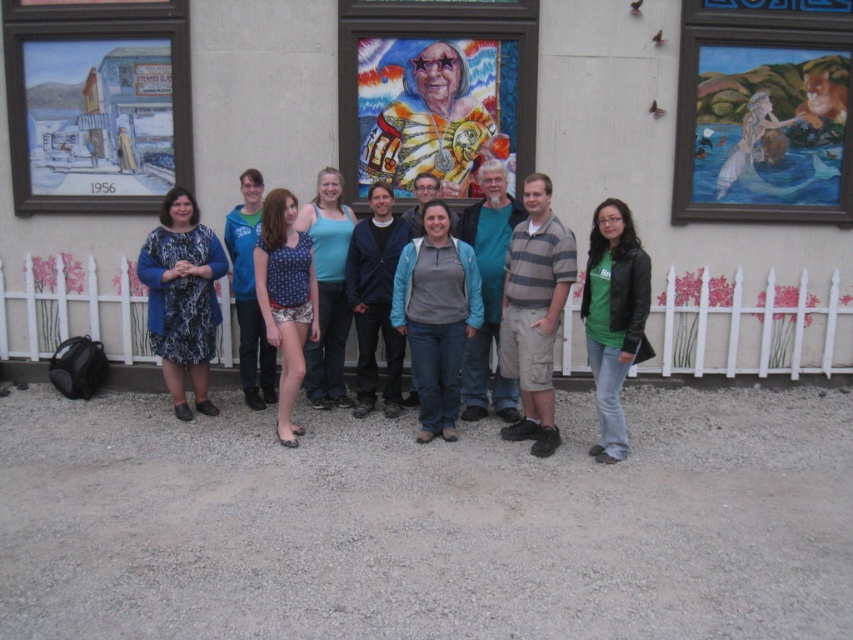
Question: Can you confirm if matte gray sweater at center is positioned to the right of blue printed shorts at center?

Choices:
 (A) no
 (B) yes

Answer: (B)

Question: Does green matte jacket at lower right have a smaller size compared to blue fabric tank top at center?

Choices:
 (A) no
 (B) yes

Answer: (B)

Question: Which is farther from the green matte jacket at lower right?

Choices:
 (A) matte gray sweater at center
 (B) blue fabric tank top at center

Answer: (B)

Question: Does matte gray sweater at center have a larger size compared to green matte jacket at lower right?

Choices:
 (A) yes
 (B) no

Answer: (B)

Question: Which point is closer to the camera taking this photo?

Choices:
 (A) (180, 353)
 (B) (303, 337)

Answer: (B)

Question: Which object appears closest to the camera in this image?

Choices:
 (A) green matte jacket at lower right
 (B) blue printed shorts at center
 (C) printed fabric dress at left

Answer: (A)